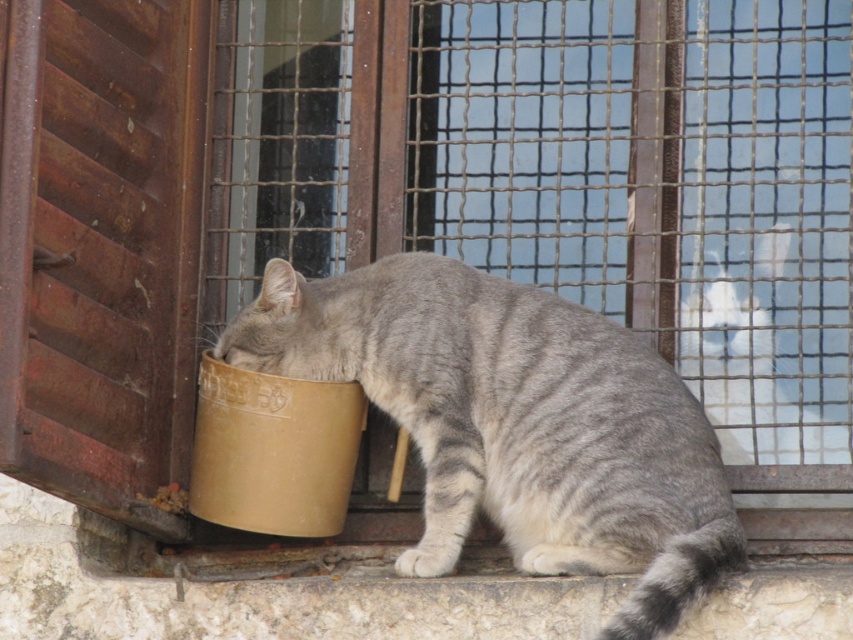
Is gray striped fur at center to the right of white fur cat at upper right from the viewer's perspective?

No, gray striped fur at center is not to the right of white fur cat at upper right.

Is gray striped fur at center to the left of white fur cat at upper right from the viewer's perspective?

Yes, gray striped fur at center is to the left of white fur cat at upper right.

This screenshot has height=640, width=853. Identify the location of gray striped fur at center. (515, 422).